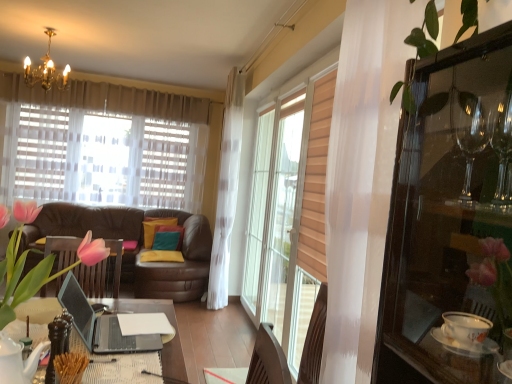
Question: Could transparent glass cabinet at right be considered to be inside teal fabric pillow at center, which ranks as the third pillow in front-to-back order?

Choices:
 (A) yes
 (B) no

Answer: (B)

Question: Is teal fabric pillow at center, marked as the 1th pillow in a back-to-front arrangement, located outside transparent glass cabinet at right?

Choices:
 (A) no
 (B) yes

Answer: (B)

Question: Is teal fabric pillow at center, which ranks as the third pillow in front-to-back order, looking in the opposite direction of transparent glass cabinet at right?

Choices:
 (A) yes
 (B) no

Answer: (B)

Question: From the image's perspective, is teal fabric pillow at center, marked as the 1th pillow in a back-to-front arrangement, beneath transparent glass cabinet at right?

Choices:
 (A) yes
 (B) no

Answer: (A)

Question: Can you confirm if teal fabric pillow at center, which ranks as the third pillow in front-to-back order, is smaller than transparent glass cabinet at right?

Choices:
 (A) yes
 (B) no

Answer: (A)

Question: Is teal fabric pillow at center, marked as the 1th pillow in a back-to-front arrangement, shorter than transparent glass cabinet at right?

Choices:
 (A) yes
 (B) no

Answer: (A)

Question: Is teal fabric pillow at center, placed as the 2th pillow when sorted from front to back, closer to camera compared to yellow fabric pillow at center, the third pillow from the back?

Choices:
 (A) yes
 (B) no

Answer: (B)

Question: Is teal fabric pillow at center, which ranks as the second pillow in back-to-front order, facing towards yellow fabric pillow at center, the third pillow from the back?

Choices:
 (A) yes
 (B) no

Answer: (A)

Question: Is teal fabric pillow at center, placed as the 2th pillow when sorted from front to back, next to yellow fabric pillow at center, the third pillow from the back, and touching it?

Choices:
 (A) yes
 (B) no

Answer: (B)

Question: Can we say teal fabric pillow at center, which ranks as the second pillow in back-to-front order, lies outside yellow fabric pillow at center, the third pillow from the back?

Choices:
 (A) yes
 (B) no

Answer: (A)

Question: From the image's perspective, would you say teal fabric pillow at center, placed as the 2th pillow when sorted from front to back, is shown under yellow fabric pillow at center, the first pillow when ordered from front to back?

Choices:
 (A) no
 (B) yes

Answer: (A)

Question: Considering the relative sizes of teal fabric pillow at center, which ranks as the second pillow in back-to-front order, and yellow fabric pillow at center, the third pillow from the back, in the image provided, is teal fabric pillow at center, which ranks as the second pillow in back-to-front order, shorter than yellow fabric pillow at center, the third pillow from the back,?

Choices:
 (A) no
 (B) yes

Answer: (A)

Question: Considering the relative positions of pink silk tulips at center and teal fabric pillow at center, marked as the 1th pillow in a back-to-front arrangement, in the image provided, is pink silk tulips at center to the left of teal fabric pillow at center, marked as the 1th pillow in a back-to-front arrangement, from the viewer's perspective?

Choices:
 (A) no
 (B) yes

Answer: (A)